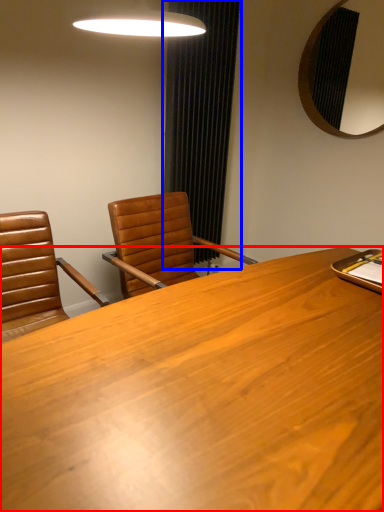
Question: Which point is closer to the camera, desk (highlighted by a red box) or curtain (highlighted by a blue box)?

Choices:
 (A) desk
 (B) curtain

Answer: (A)